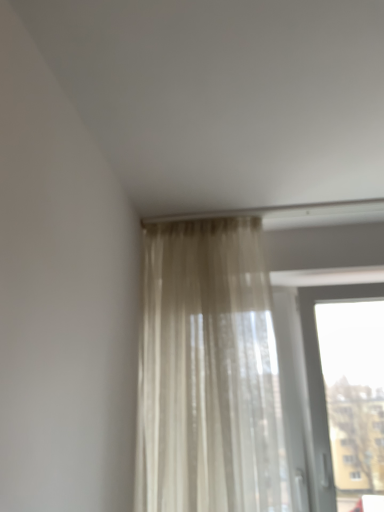
Question: Is sheer beige curtain at upper center wider or thinner than transparent glass window at upper right?

Choices:
 (A) thin
 (B) wide

Answer: (A)

Question: Is sheer beige curtain at upper center spatially inside transparent glass window at upper right, or outside of it?

Choices:
 (A) outside
 (B) inside

Answer: (A)

Question: From the image's perspective, relative to transparent glass window at upper right, is sheer beige curtain at upper center above or below?

Choices:
 (A) below
 (B) above

Answer: (B)

Question: Considering the positions of transparent glass window at upper right and sheer beige curtain at upper center in the image, is transparent glass window at upper right taller or shorter than sheer beige curtain at upper center?

Choices:
 (A) tall
 (B) short

Answer: (B)

Question: Considering the positions of point (322, 403) and point (246, 330), is point (322, 403) closer or farther from the camera than point (246, 330)?

Choices:
 (A) closer
 (B) farther

Answer: (B)

Question: Is transparent glass window at upper right in front of or behind sheer beige curtain at upper center in the image?

Choices:
 (A) behind
 (B) front

Answer: (A)

Question: From a real-world perspective, relative to sheer beige curtain at upper center, is transparent glass window at upper right vertically above or below?

Choices:
 (A) above
 (B) below

Answer: (B)